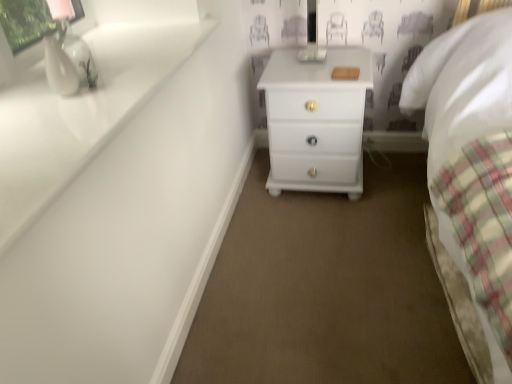
Question: From the image's perspective, relative to white glossy vase at upper left, is white glossy sink at upper left above or below?

Choices:
 (A) above
 (B) below

Answer: (B)

Question: Considering their positions, is white glossy sink at upper left located in front of or behind white glossy vase at upper left?

Choices:
 (A) front
 (B) behind

Answer: (A)

Question: Which object is the farthest from the white glossy vase at upper left?

Choices:
 (A) white glossy chest of drawers at center
 (B) white glossy sink at upper left

Answer: (A)

Question: Considering the real-world distances, which object is farthest from the white glossy chest of drawers at center?

Choices:
 (A) white glossy sink at upper left
 (B) white glossy vase at upper left

Answer: (B)